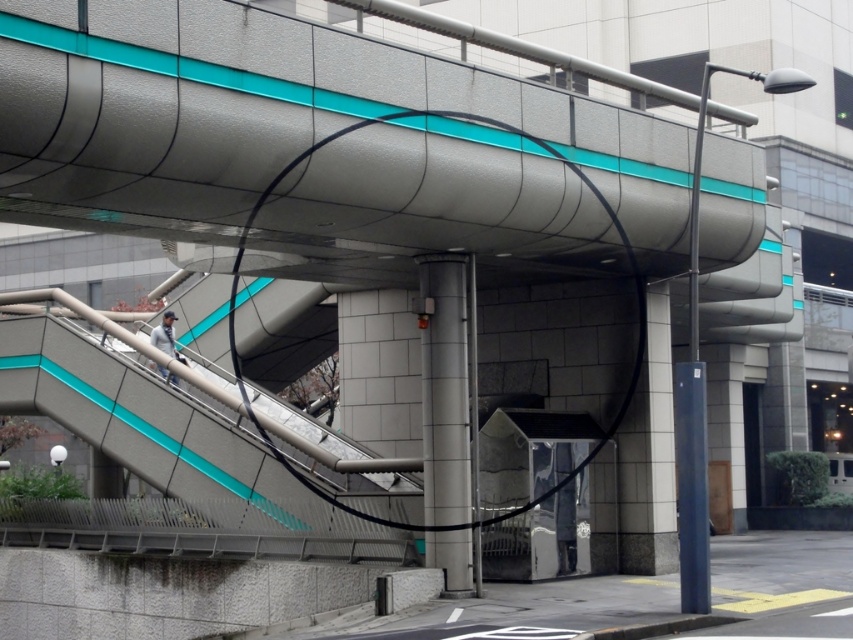
You are standing on the metallic silver stairs at center and want to reach the satin silver pole at center. Which direction should you move to get closer to the pole?

The satin silver pole at center is behind the metallic silver stairs at center, so you should move backward to reach it.

You are standing at the base of the bridge and want to determine which of the two points, point (117, 416) or point (422, 467), is closer to you. Based on the scene, which point is nearer?

Point (117, 416) is closer to you because it is further to the viewer than point (422, 467).

You are an architect designing a new urban plaza and need to place both the metallic silver stairs at center and the satin silver pole at center in the same area. Based on the image, which object should you prioritize placing first to ensure there is enough space for both?

The metallic silver stairs at center occupies less space than the satin silver pole at center, so you should prioritize placing the satin silver pole at center first to ensure there is enough space for both.